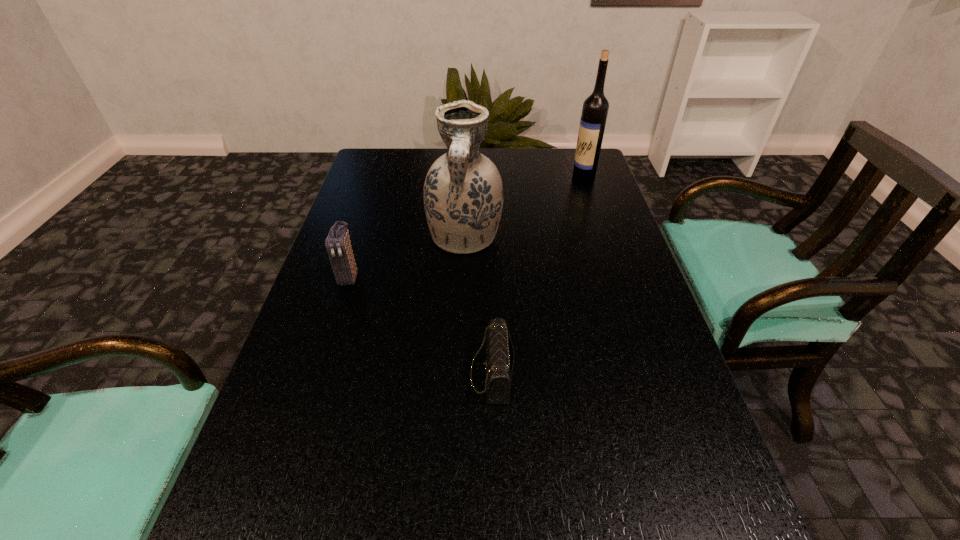
At what (x,y) coordinates should I click in order to perform the action: click on the rightmost object. Please return your answer as a coordinate pair (x, y). Image resolution: width=960 pixels, height=540 pixels. Looking at the image, I should click on (595, 109).

At what (x,y) coordinates should I click in order to perform the action: click on wine bottle. Please return your answer as a coordinate pair (x, y). Looking at the image, I should click on (595, 109).

Identify the location of vase. (463, 197).

In order to click on the left clutch bag in this screenshot , I will do `click(338, 243)`.

Where is `the farther clutch bag`? This screenshot has height=540, width=960. the farther clutch bag is located at coordinates (338, 243).

Find the location of a particular element. The image size is (960, 540). the shorter clutch bag is located at coordinates (499, 363).

What are the coordinates of `the nearer clutch bag` in the screenshot? It's located at tap(499, 363).

Image resolution: width=960 pixels, height=540 pixels. I want to click on free spot located on the label of the farthest object, so click(497, 176).

This screenshot has width=960, height=540. Identify the location of vacant area situated 0.260m on the label of the farthest object. (491, 176).

At what (x,y) coordinates should I click in order to perform the action: click on vacant area located 0.190m on the label of the farthest object. Please return your answer as a coordinate pair (x, y). The height and width of the screenshot is (540, 960). Looking at the image, I should click on (513, 176).